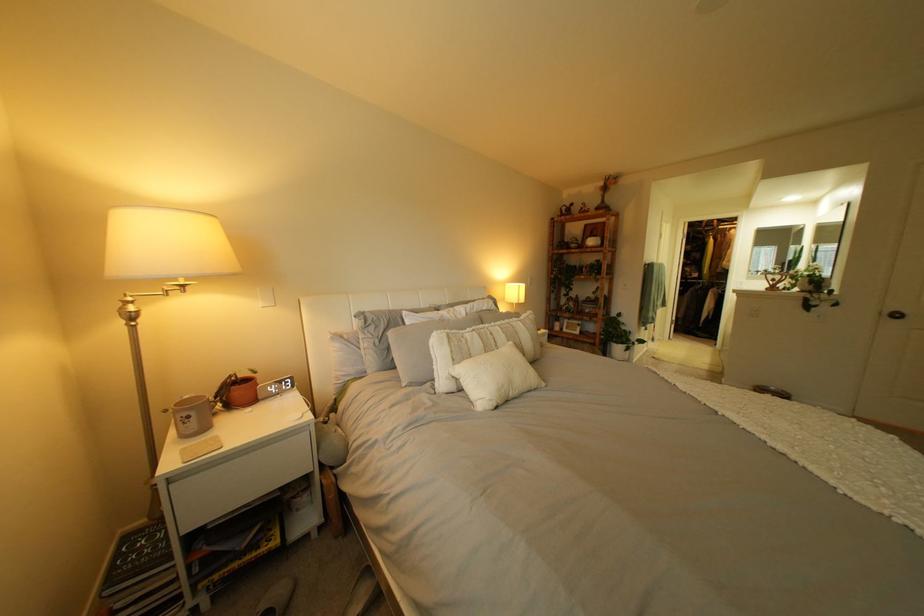
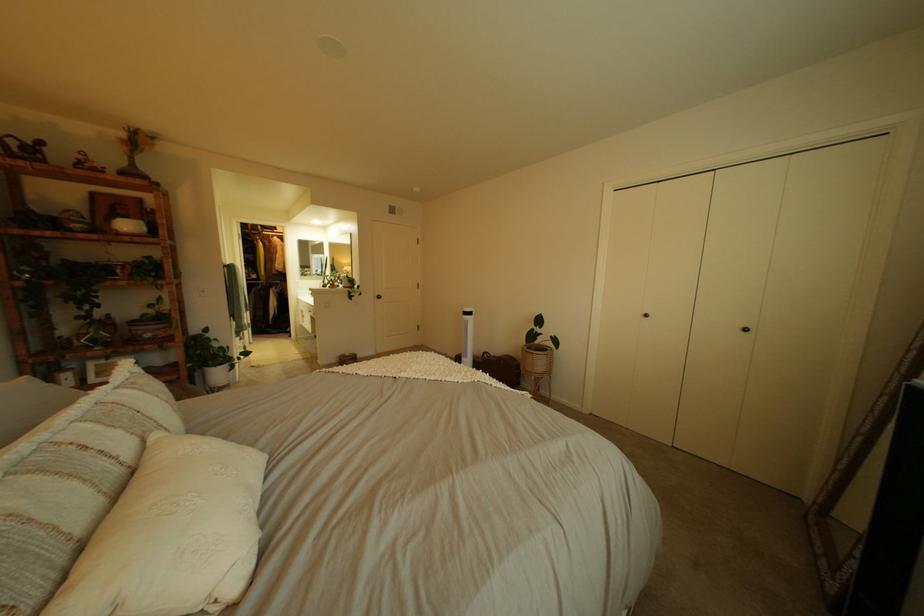
In the second image, find the point that corresponds to (x=617, y=185) in the first image.

(139, 137)